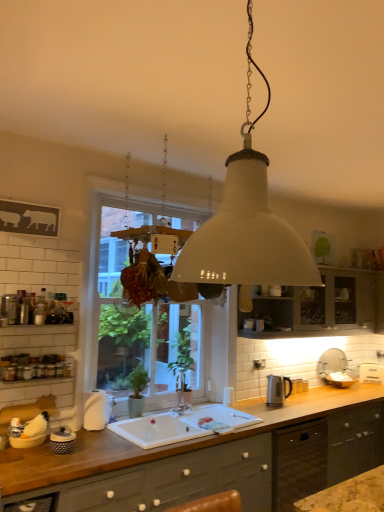
Question: In the image, is white ceramic sink at center on the left side or the right side of white glass window at center?

Choices:
 (A) right
 (B) left

Answer: (A)

Question: Considering their positions, is white ceramic sink at center located in front of or behind white glass window at center?

Choices:
 (A) front
 (B) behind

Answer: (A)

Question: Which object is the farthest from the matte gray cabinets at lower center, the first cabinetry from the bottom?

Choices:
 (A) white glass window at center
 (B) white matte lampshade at center
 (C) matte gray cabinet at center, the 1th cabinetry viewed from the right
 (D) white ceramic sink at center
 (E) matte black container at lower left, which is the second appliance in back-to-front order

Answer: (B)

Question: Based on their relative distances, which object is farther from the polished stainless steel kettle at right, arranged as the 1th appliance when viewed from the back?

Choices:
 (A) white ceramic sink at center
 (B) white matte lampshade at center
 (C) matte gray cabinets at lower center, the 1th cabinetry positioned from the left
 (D) white glass window at center
 (E) matte gray cabinet at center, the 2th cabinetry when ordered from bottom to top

Answer: (B)